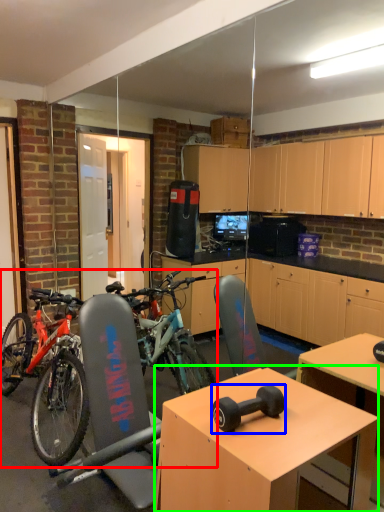
Question: Estimate the real-world distances between objects in this image. Which object is farther from bicycle (highlighted by a red box), dumbbell (highlighted by a blue box) or desk (highlighted by a green box)?

Choices:
 (A) dumbbell
 (B) desk

Answer: (A)